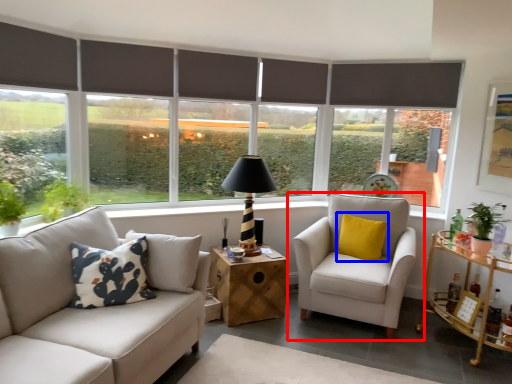
Question: Which of the following is the closest to the observer, chair (highlighted by a red box) or pillow (highlighted by a blue box)?

Choices:
 (A) chair
 (B) pillow

Answer: (A)